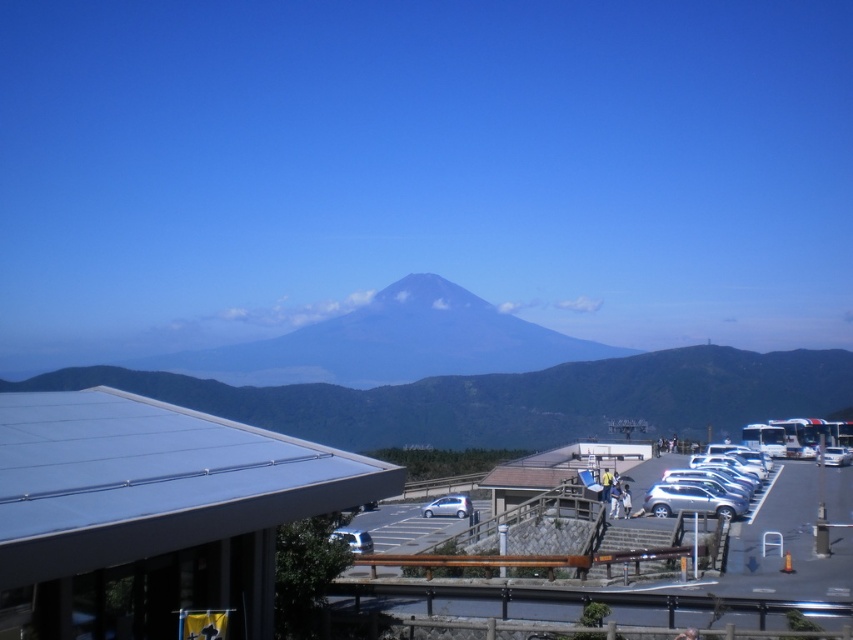
Question: Which point is farther to the camera?

Choices:
 (A) (525, 593)
 (B) (461, 513)

Answer: (B)

Question: Does metallic silver cars at center-right have a lesser width compared to silver metallic suv at right?

Choices:
 (A) yes
 (B) no

Answer: (B)

Question: Does metallic silver car at center come behind white metallic car at right?

Choices:
 (A) yes
 (B) no

Answer: (B)

Question: Which object is positioned farthest from the silver metallic suv at center-right?

Choices:
 (A) silver metallic car at center
 (B) white metallic car at right

Answer: (B)

Question: Is gray/smooth mountain at center positioned in front of silver metallic suv at right?

Choices:
 (A) no
 (B) yes

Answer: (A)

Question: Which object is the farthest from the silver metallic car at center?

Choices:
 (A) white metallic car at right
 (B) silver metallic suv at right

Answer: (A)